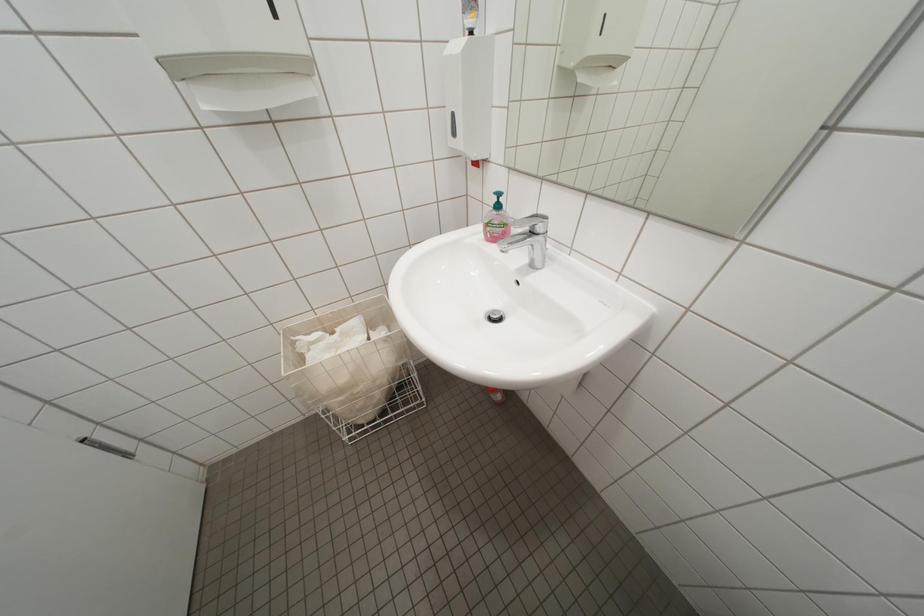
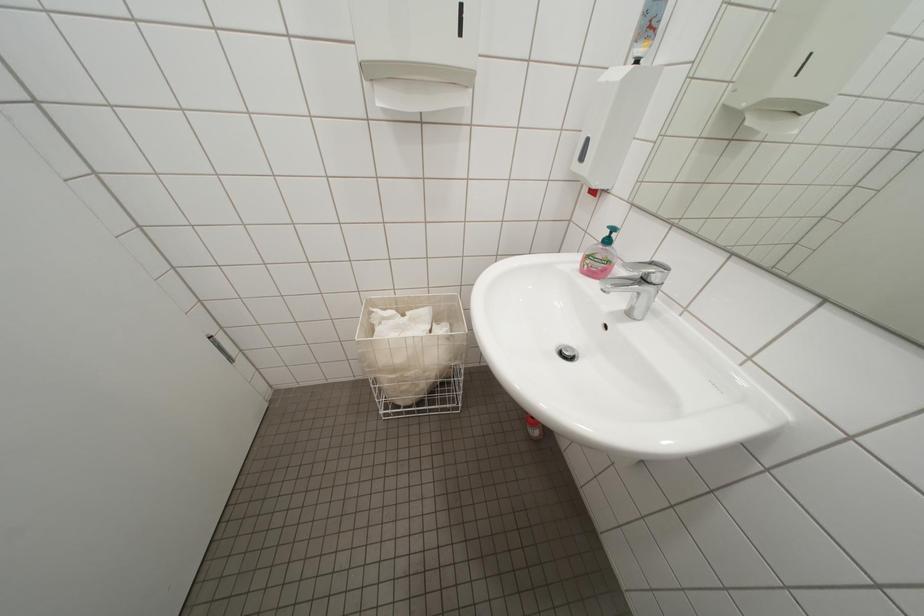
Question: The images are taken continuously from a first-person perspective. In which direction is your viewpoint rotating?

Choices:
 (A) Left
 (B) Right
 (C) Up
 (D) Down

Answer: (A)